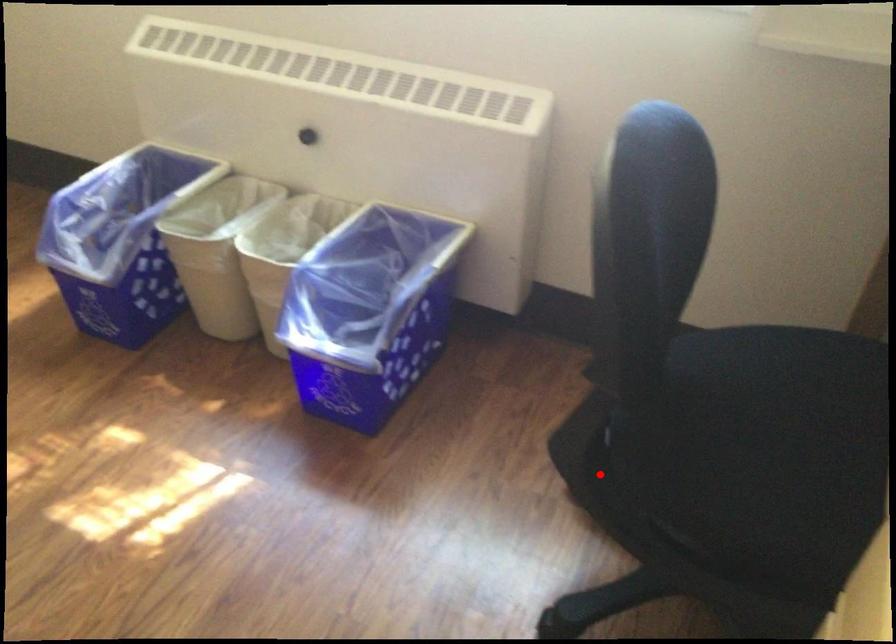
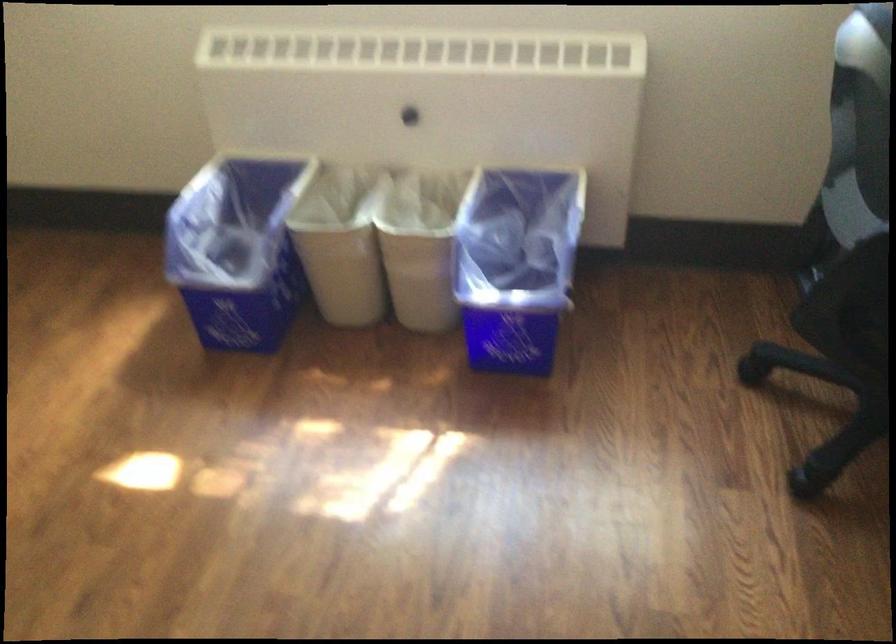
Locate, in the second image, the point that corresponds to the highlighted location in the first image.

(848, 334)